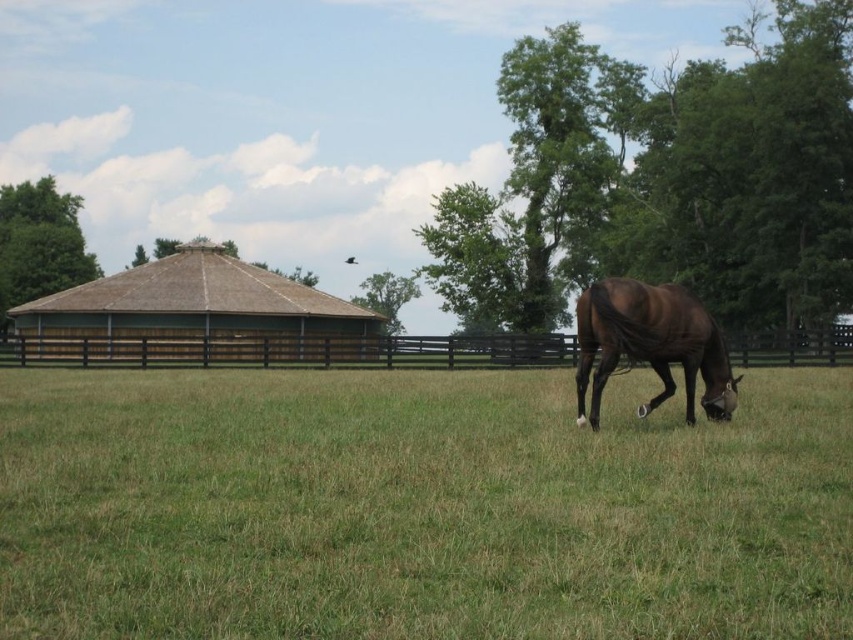
Is green leafy tree at upper right shorter than brown glossy horse at lower right?

No.

Locate an element on the screen. The height and width of the screenshot is (640, 853). green leafy tree at upper right is located at coordinates (665, 180).

Is point (666, 120) positioned behind point (733, 401)?

Yes.

Find the location of a particular element. Image resolution: width=853 pixels, height=640 pixels. green leafy tree at upper right is located at coordinates (665, 180).

Does brown wooden fence at upper left have a smaller size compared to brown wooden fence at left?

Incorrect, brown wooden fence at upper left is not smaller in size than brown wooden fence at left.

What do you see at coordinates (196, 316) in the screenshot? The image size is (853, 640). I see `brown wooden fence at upper left` at bounding box center [196, 316].

Is point (83, 289) closer to camera compared to point (556, 336)?

That is False.

Identify the location of brown wooden fence at upper left. This screenshot has height=640, width=853. (196, 316).

Can you confirm if green grass at lower right is smaller than brown wooden fence at left?

Correct, green grass at lower right occupies less space than brown wooden fence at left.

Where is `green grass at lower right`? This screenshot has width=853, height=640. green grass at lower right is located at coordinates (419, 508).

Is point (785, 445) farther from viewer compared to point (32, 342)?

No, it is in front of (32, 342).

Locate an element on the screen. This screenshot has height=640, width=853. green grass at lower right is located at coordinates (419, 508).